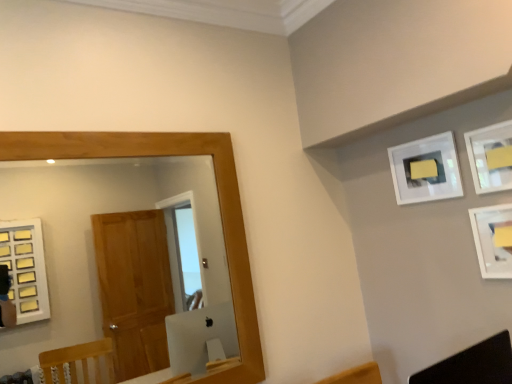
Question: Is point pos(501,130) positioned closer to the camera than point pos(54,269)?

Choices:
 (A) closer
 (B) farther

Answer: (A)

Question: Would you say matte white picture frame at upper right, the 2th picture frame in the back-to-front sequence, is inside or outside wooden-framed mirror at left?

Choices:
 (A) inside
 (B) outside

Answer: (B)

Question: Based on their relative distances, which object is nearer to the white matte picture frame at upper right, acting as the 3th picture frame starting from the front?

Choices:
 (A) matte white picture frame at upper right, the 2th picture frame in the back-to-front sequence
 (B) black leather swivel chair at lower right
 (C) wooden-framed mirror at left
 (D) white matte picture frame at upper right, the 3th picture frame positioned from the back

Answer: (A)

Question: Estimate the real-world distances between objects in this image. Which object is closer to the white matte picture frame at upper right, acting as the 3th picture frame starting from the front?

Choices:
 (A) wooden-framed mirror at left
 (B) white matte picture frame at upper right, the 3th picture frame positioned from the back
 (C) matte white picture frame at upper right, acting as the second picture frame starting from the front
 (D) black leather swivel chair at lower right

Answer: (C)